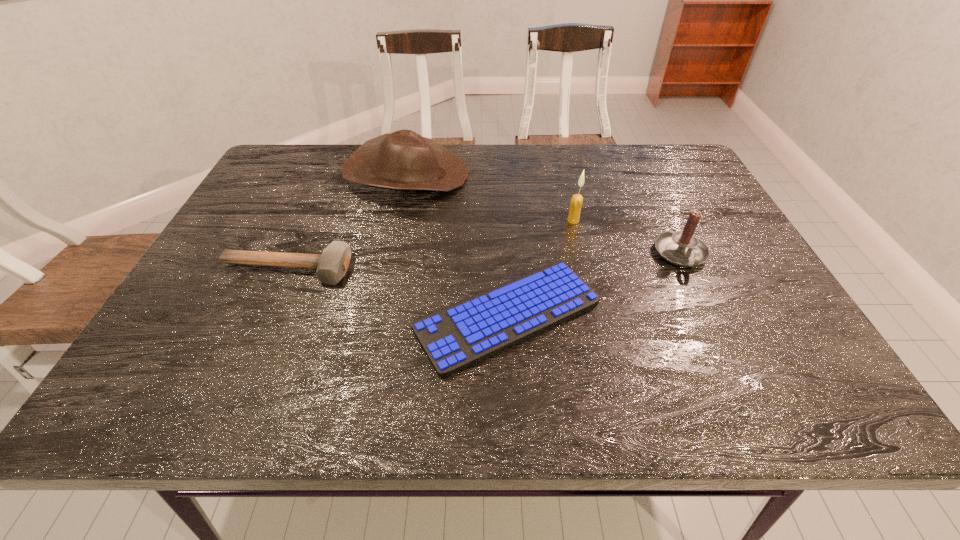
Where is `object identified as the fourth closest to the shortest object`? object identified as the fourth closest to the shortest object is located at coordinates (403, 160).

You are a GUI agent. You are given a task and a screenshot of the screen. Output one action in this format:
    pyautogui.click(x=<x>, y=<y>)
    Task: Click on the second closest object to the second farthest object
    The image size is (960, 540).
    Given the screenshot: What is the action you would take?
    pyautogui.click(x=682, y=248)

This screenshot has height=540, width=960. I want to click on free space that satisfies the following two spatial constraints: 1. on the back side of the mallet; 2. on the left side of the farther candle, so click(309, 221).